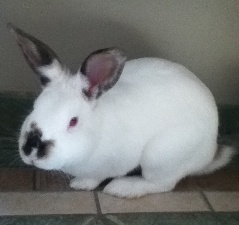
Image resolution: width=239 pixels, height=225 pixels. I want to click on white fur, so click(x=167, y=148).